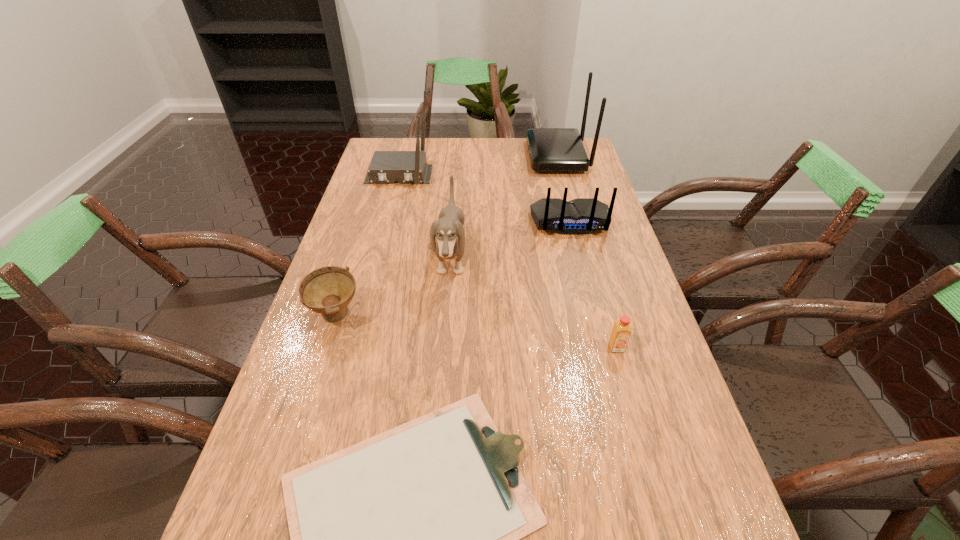
Where is `the leftmost router`? the leftmost router is located at coordinates (386, 166).

This screenshot has height=540, width=960. Find the location of `puppy`. puppy is located at coordinates (448, 229).

Where is `the shortest router`? The height and width of the screenshot is (540, 960). the shortest router is located at coordinates (580, 216).

Locate an element on the screen. The width and height of the screenshot is (960, 540). the nearest router is located at coordinates (580, 216).

Identify the location of soup bowl. (328, 290).

Where is `the sixth tallest object`? This screenshot has height=540, width=960. the sixth tallest object is located at coordinates (621, 331).

At what (x,y) coordinates should I click in order to perform the action: click on orange juice. Please return your answer as a coordinate pair (x, y). Image resolution: width=960 pixels, height=540 pixels. Looking at the image, I should click on (621, 331).

Image resolution: width=960 pixels, height=540 pixels. I want to click on vacant area situated on the back of the leftmost router to connect cables, so click(x=373, y=271).

Locate an element on the screen. Image resolution: width=960 pixels, height=540 pixels. vacant space located at the face of the puppy is located at coordinates (495, 257).

Locate an element on the screen. vacant space situated on the back of the shortest router is located at coordinates (585, 278).